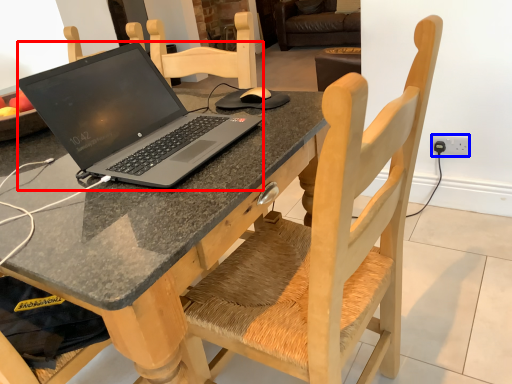
Question: Which object is closer to the camera taking this photo, laptop (highlighted by a red box) or electric outlet (highlighted by a blue box)?

Choices:
 (A) laptop
 (B) electric outlet

Answer: (A)